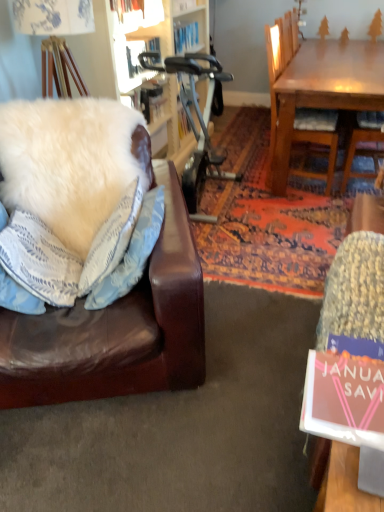
Question: Is point (380, 376) positioned closer to the camera than point (380, 420)?

Choices:
 (A) closer
 (B) farther

Answer: (B)

Question: From a real-world perspective, is pink matte book at lower right physically located above or below knitted fabric swivel chair at lower right?

Choices:
 (A) above
 (B) below

Answer: (A)

Question: Estimate the real-world distances between objects in this image. Which object is closer to the white fluffy pillow at left, which appears as the 1th pillow when viewed from the left?

Choices:
 (A) wooden chair at upper right
 (B) white fluffy pillow at left, the 2th pillow in the left-to-right sequence
 (C) white fluffy pillow at left, which ranks as the 1th pillow in right-to-left order
 (D) knitted fabric swivel chair at lower right
 (E) pink matte book at lower right

Answer: (C)

Question: Based on their relative distances, which object is nearer to the white fluffy pillow at left, marked as the second pillow in a right-to-left arrangement?

Choices:
 (A) knitted fabric swivel chair at lower right
 (B) white fluffy pillow at left, which ranks as the 3th pillow in left-to-right order
 (C) white fluffy pillow at left, which appears as the 1th pillow when viewed from the left
 (D) pink matte book at lower right
 (E) wooden chair at upper right

Answer: (C)